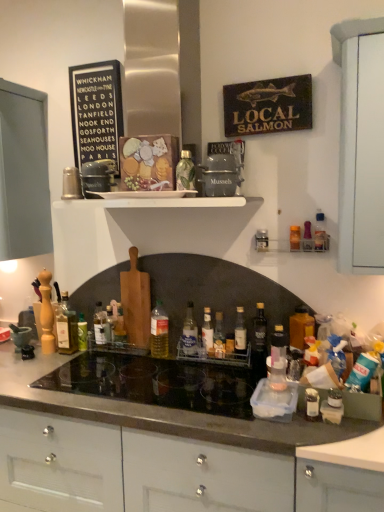
This screenshot has width=384, height=512. In order to click on translucent plastic bottle at center, the fourth bottle from the left in this screenshot , I will do `click(159, 331)`.

The image size is (384, 512). Identify the location of clear glass bottle at center, which is the sixth bottle from right to left. (207, 330).

What do you see at coordinates (101, 325) in the screenshot? This screenshot has width=384, height=512. I see `translucent glass bottle at center, the tenth bottle from the right` at bounding box center [101, 325].

Measure the distance between black wood sign at upper left and camera.

black wood sign at upper left is 1.95 meters away from camera.

Identify the location of translucent glass bottle at left, the 1th bottle in the left-to-right sequence. [66, 327].

What are the coordinates of `translucent plastic bottle at center, arranged as the 9th bottle when viewed from the right` in the screenshot? It's located at (159, 331).

Is black wood sign at upper left at the back of translucent plastic bottle at center, which appears as the second bottle when viewed from the right?

No, black wood sign at upper left is not at the back of translucent plastic bottle at center, which appears as the second bottle when viewed from the right.

Between translucent plastic bottle at center, placed as the eleventh bottle when sorted from left to right, and black wood sign at upper left, which one appears on the right side from the viewer's perspective?

From the viewer's perspective, translucent plastic bottle at center, placed as the eleventh bottle when sorted from left to right, appears more on the right side.

Considering the sizes of objects translucent plastic bottle at center, placed as the eleventh bottle when sorted from left to right, and black wood sign at upper left in the image provided, who is smaller, translucent plastic bottle at center, placed as the eleventh bottle when sorted from left to right, or black wood sign at upper left?

translucent plastic bottle at center, placed as the eleventh bottle when sorted from left to right.

Which object is closer to the camera, translucent plastic bottle at center, which appears as the second bottle when viewed from the right, or black wood sign at upper left?

Positioned in front is translucent plastic bottle at center, which appears as the second bottle when viewed from the right.

Considering the positions of objects black glass bottle at center, which appears as the third bottle when viewed from the right, and clear glass bottle at center, placed as the 7th bottle when sorted from left to right, in the image provided, who is more to the left, black glass bottle at center, which appears as the third bottle when viewed from the right, or clear glass bottle at center, placed as the 7th bottle when sorted from left to right,?

From the viewer's perspective, clear glass bottle at center, placed as the 7th bottle when sorted from left to right, appears more on the left side.

Looking at this image, is black glass bottle at center, placed as the tenth bottle when sorted from left to right, with clear glass bottle at center, which is the sixth bottle from right to left?

No, black glass bottle at center, placed as the tenth bottle when sorted from left to right, is not beside clear glass bottle at center, which is the sixth bottle from right to left.

At what (x,y) coordinates should I click in order to perform the action: click on bottle that is the 5th one when counting backward from the black glass bottle at center, which appears as the third bottle when viewed from the right. Please return your answer as a coordinate pair (x, y). Looking at the image, I should click on (207, 330).

Considering the relative sizes of black glass bottle at center, which appears as the third bottle when viewed from the right, and clear glass bottle at center, placed as the 7th bottle when sorted from left to right, in the image provided, is black glass bottle at center, which appears as the third bottle when viewed from the right, shorter than clear glass bottle at center, placed as the 7th bottle when sorted from left to right,?

Incorrect, the height of black glass bottle at center, which appears as the third bottle when viewed from the right, does not fall short of that of clear glass bottle at center, placed as the 7th bottle when sorted from left to right.

Between translucent glass bottle at center, which is the eighth bottle in left-to-right order, and translucent plastic bottle at center, the fourth bottle from the left, which one appears on the left side from the viewer's perspective?

From the viewer's perspective, translucent plastic bottle at center, the fourth bottle from the left, appears more on the left side.

What's the angular difference between translucent glass bottle at center, which is the eighth bottle in left-to-right order, and translucent plastic bottle at center, the fourth bottle from the left,'s facing directions?

The facing directions of translucent glass bottle at center, which is the eighth bottle in left-to-right order, and translucent plastic bottle at center, the fourth bottle from the left, are 45 degrees apart.

Considering the sizes of objects translucent glass bottle at center, which is the fifth bottle from right to left, and translucent plastic bottle at center, the fourth bottle from the left, in the image provided, who is wider, translucent glass bottle at center, which is the fifth bottle from right to left, or translucent plastic bottle at center, the fourth bottle from the left,?

Wider between the two is translucent plastic bottle at center, the fourth bottle from the left.

Is translucent plastic bottle at center, arranged as the 9th bottle when viewed from the right, located within translucent glass bottle at center, which is the eighth bottle in left-to-right order?

No, translucent plastic bottle at center, arranged as the 9th bottle when viewed from the right, is located outside of translucent glass bottle at center, which is the eighth bottle in left-to-right order.

Is smooth gray countertop at center turned away from translucent glass bottle at left, which is the 12th bottle from right to left?

No, smooth gray countertop at center is not facing the opposite direction of translucent glass bottle at left, which is the 12th bottle from right to left.

Is smooth gray countertop at center inside the boundaries of translucent glass bottle at left, which is the 12th bottle from right to left, or outside?

smooth gray countertop at center exists outside the volume of translucent glass bottle at left, which is the 12th bottle from right to left.

Who is shorter, smooth gray countertop at center or translucent glass bottle at left, the 1th bottle in the left-to-right sequence?

translucent glass bottle at left, the 1th bottle in the left-to-right sequence, is shorter.

Is smooth gray countertop at center positioned behind translucent glass bottle at left, the 1th bottle in the left-to-right sequence?

No, smooth gray countertop at center is in front of translucent glass bottle at left, the 1th bottle in the left-to-right sequence.

Based on the photo, is green glass bottle at center, the second bottle viewed from the left, turned away from black wood sign at upper left?

No, black wood sign at upper left is not at the back of green glass bottle at center, the second bottle viewed from the left.

From the image's perspective, which one is positioned higher, green glass bottle at center, the second bottle viewed from the left, or black wood sign at upper left?

black wood sign at upper left appears higher in the image.

Considering the sizes of objects green glass bottle at center, the second bottle viewed from the left, and black wood sign at upper left in the image provided, who is bigger, green glass bottle at center, the second bottle viewed from the left, or black wood sign at upper left?

black wood sign at upper left.

Which is more to the right, green glass bottle at center, the second bottle viewed from the left, or black wood sign at upper left?

black wood sign at upper left.

From a real-world perspective, who is located lower, translucent plastic bottle at center, arranged as the 9th bottle when viewed from the right, or translucent plastic bottle at right, which appears as the first bottle when viewed from the right?

translucent plastic bottle at center, arranged as the 9th bottle when viewed from the right, from a real-world perspective.

Does point (155, 306) come closer to viewer compared to point (313, 324)?

No.

Is translucent plastic bottle at center, arranged as the 9th bottle when viewed from the right, wider than translucent plastic bottle at right, which appears as the first bottle when viewed from the right?

No.

Is black glass bottle at center, placed as the tenth bottle when sorted from left to right, spatially inside translucent glass bottle at center, which appears as the third bottle when viewed from the left, or outside of it?

black glass bottle at center, placed as the tenth bottle when sorted from left to right, cannot be found inside translucent glass bottle at center, which appears as the third bottle when viewed from the left.

Looking at the image, does black glass bottle at center, placed as the tenth bottle when sorted from left to right, seem bigger or smaller compared to translucent glass bottle at center, which appears as the third bottle when viewed from the left?

Considering their sizes, black glass bottle at center, placed as the tenth bottle when sorted from left to right, takes up more space than translucent glass bottle at center, which appears as the third bottle when viewed from the left.

Is black glass bottle at center, placed as the tenth bottle when sorted from left to right, at the left side of translucent glass bottle at center, which appears as the third bottle when viewed from the left?

Incorrect, black glass bottle at center, placed as the tenth bottle when sorted from left to right, is not on the left side of translucent glass bottle at center, which appears as the third bottle when viewed from the left.

Is black glass bottle at center, which appears as the third bottle when viewed from the right, looking in the opposite direction of translucent glass bottle at center, which appears as the third bottle when viewed from the left?

No, black glass bottle at center, which appears as the third bottle when viewed from the right, is not facing the opposite direction of translucent glass bottle at center, which appears as the third bottle when viewed from the left.

I want to click on bulletin board that is above the translucent plastic bottle at center, placed as the eleventh bottle when sorted from left to right (from the image's perspective), so click(96, 111).

At what (x,y) coordinates should I click in order to perform the action: click on bottle that is the 4th one when counting downward from the black glass bottle at center, placed as the tenth bottle when sorted from left to right (from the image's perspective). Please return your answer as a coordinate pair (x, y). Looking at the image, I should click on (207, 330).

Which object lies further to the anchor point translucent glass bottle at left, which is the 12th bottle from right to left, clear glass bottle at center, placed as the seventh bottle when sorted from right to left, or black wood sign at upper left?

Based on the image, black wood sign at upper left appears to be further to translucent glass bottle at left, which is the 12th bottle from right to left.

When comparing their distances from translucent glass bottle at left, which is the 12th bottle from right to left, does translucent glass bottle at center, which appears as the third bottle when viewed from the left, or matte gray container at center seem closer?

translucent glass bottle at center, which appears as the third bottle when viewed from the left, is closer to translucent glass bottle at left, which is the 12th bottle from right to left.

From the picture: Which object lies nearer to the anchor point translucent glass bottle at center, which is the fifth bottle from right to left, translucent glass bottle at center, which appears as the third bottle when viewed from the left, or translucent glass bottle at left, the 1th bottle in the left-to-right sequence?

The object closer to translucent glass bottle at center, which is the fifth bottle from right to left, is translucent glass bottle at center, which appears as the third bottle when viewed from the left.

Looking at this image, based on their spatial positions, is translucent plastic bottle at right, which appears as the first bottle when viewed from the right, or smooth gray countertop at center closer to translucent plastic bottle at center, which appears as the second bottle when viewed from the right?

translucent plastic bottle at right, which appears as the first bottle when viewed from the right, lies closer to translucent plastic bottle at center, which appears as the second bottle when viewed from the right, than the other object.

Which object lies nearer to the anchor point green glass bottle at center, which is the eleventh bottle in right-to-left order, clear glass bottle at center, which is the sixth bottle from right to left, or smooth gray countertop at center?

clear glass bottle at center, which is the sixth bottle from right to left, lies closer to green glass bottle at center, which is the eleventh bottle in right-to-left order, than the other object.

Looking at this image, which object lies nearer to the anchor point translucent glass bottle at center, which is the eighth bottle in left-to-right order, clear glass bottle at center, placed as the 7th bottle when sorted from left to right, or matte gray container at center?

clear glass bottle at center, placed as the 7th bottle when sorted from left to right, lies closer to translucent glass bottle at center, which is the eighth bottle in left-to-right order, than the other object.

Looking at the image, which one is located further to black wood sign at upper left, translucent plastic bottle at center, the fourth bottle from the left, or green glass bottle at center, which is the eleventh bottle in right-to-left order?

The object further to black wood sign at upper left is green glass bottle at center, which is the eleventh bottle in right-to-left order.

Based on their spatial positions, is translucent plastic bottle at center, placed as the eleventh bottle when sorted from left to right, or translucent glass bottle at center, the tenth bottle from the right, closer to green glass bottle at upper center, acting as the eighth bottle starting from the right?

translucent plastic bottle at center, placed as the eleventh bottle when sorted from left to right.

Where is `appliance between black wood sign at upper left and smooth gray countertop at center in the vertical direction`? This screenshot has width=384, height=512. appliance between black wood sign at upper left and smooth gray countertop at center in the vertical direction is located at coordinates (222, 170).

Locate an element on the screen. home appliance between smooth gray countertop at center and translucent plastic bottle at center, the fourth bottle from the left, in the front-back direction is located at coordinates (156, 383).

Where is `appliance between black wood sign at upper left and green glass bottle at center, which is the eleventh bottle in right-to-left order, in the up-down direction`? appliance between black wood sign at upper left and green glass bottle at center, which is the eleventh bottle in right-to-left order, in the up-down direction is located at coordinates (222, 170).

The image size is (384, 512). I want to click on shelf between black wood sign at upper left and smooth gray countertop at center vertically, so click(x=162, y=202).